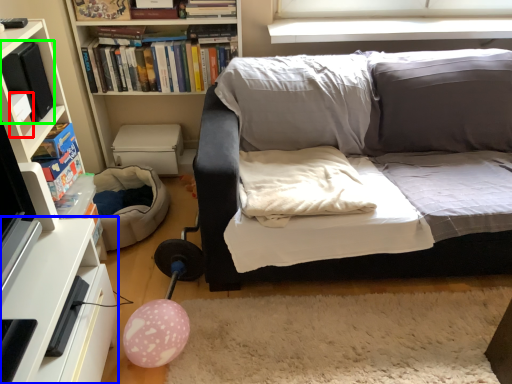
Question: Which object is the closest to the paperback book (highlighted by a red box)? Choose among these: table (highlighted by a blue box) or paperback book (highlighted by a green box).

Choices:
 (A) table
 (B) paperback book

Answer: (B)